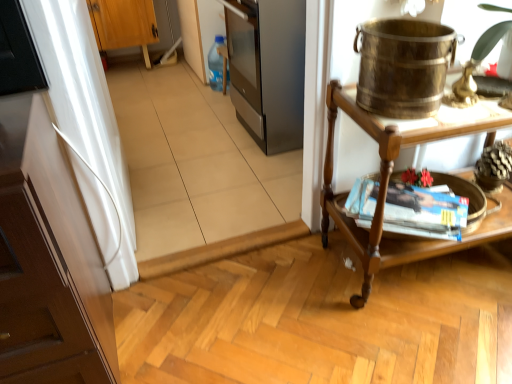
You are a GUI agent. You are given a task and a screenshot of the screen. Output one action in this format:
    pyautogui.click(x=<x>, y=<y>)
    Task: Click on the free space in front of wooden cabinet at upper left, marked as the 1th cabinetry in a back-to-front arrangement
    The image size is (512, 384).
    Given the screenshot: What is the action you would take?
    pyautogui.click(x=132, y=81)